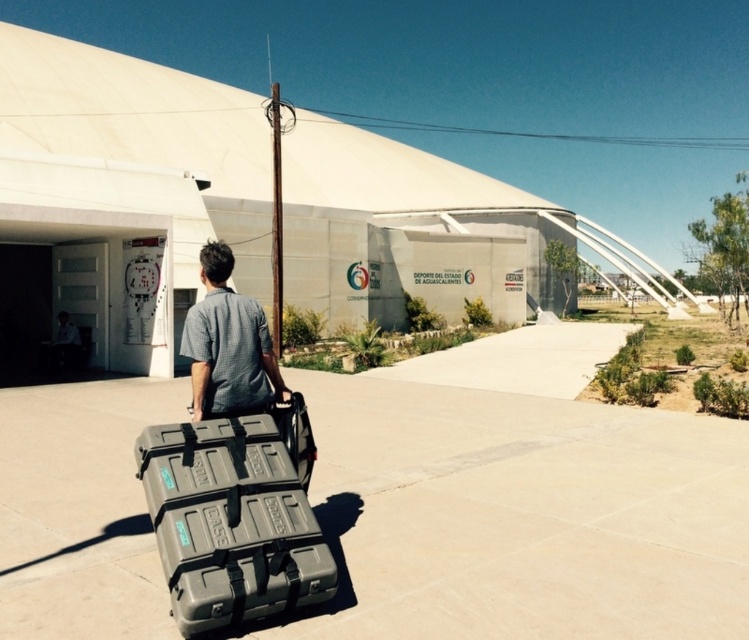
Question: Can you confirm if matte gray case at center is positioned above gray cotton shirt at center?

Choices:
 (A) no
 (B) yes

Answer: (A)

Question: Which object appears farthest from the camera in this image?

Choices:
 (A) gray cotton shirt at center
 (B) matte gray case at center

Answer: (A)

Question: Is matte gray case at center smaller than gray cotton shirt at center?

Choices:
 (A) yes
 (B) no

Answer: (B)

Question: Is matte gray case at center wider than gray cotton shirt at center?

Choices:
 (A) no
 (B) yes

Answer: (B)